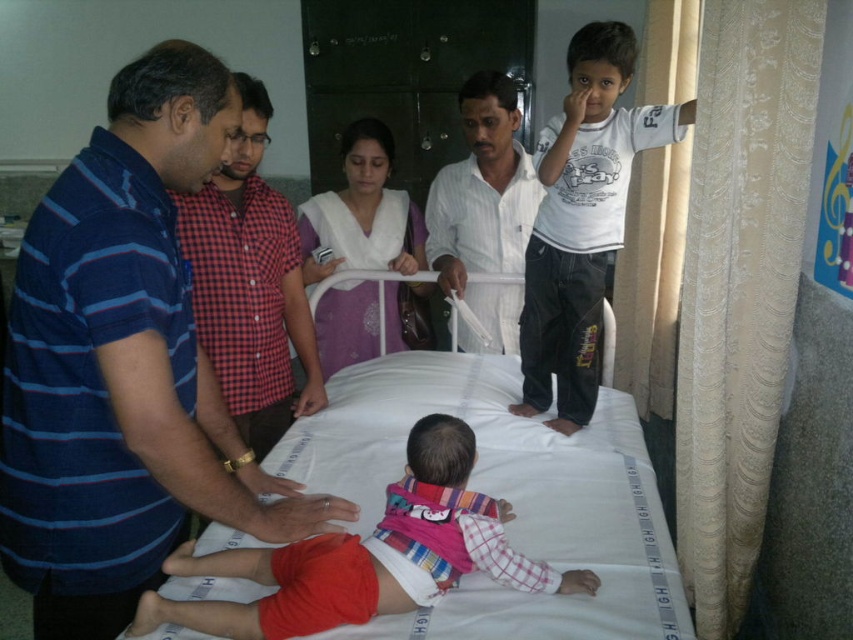
Is striped fabric baby at center thinner than blue striped shirt at left?

Incorrect, striped fabric baby at center's width is not less than blue striped shirt at left's.

Which is in front, point (317, 579) or point (236, 211)?

Point (317, 579) is more forward.

Is point (289, 588) farther from camera compared to point (238, 310)?

That is False.

The height and width of the screenshot is (640, 853). I want to click on striped fabric baby at center, so click(x=369, y=556).

Measure the distance from striped fabric baby at center to white striped shirt at center.

3.64 feet

Is striped fabric baby at center wider than white striped shirt at center?

Yes.

Is point (364, 604) positioned after point (461, 340)?

No, (364, 604) is in front of (461, 340).

The width and height of the screenshot is (853, 640). I want to click on striped fabric baby at center, so click(x=369, y=556).

Between striped fabric baby at center and white cotton shirt at upper right, which one has less height?

striped fabric baby at center is shorter.

Is striped fabric baby at center further to camera compared to white cotton shirt at upper right?

No, it is not.

Is point (456, 513) positioned after point (616, 192)?

No, (456, 513) is in front of (616, 192).

This screenshot has height=640, width=853. In order to click on striped fabric baby at center in this screenshot , I will do `click(369, 556)`.